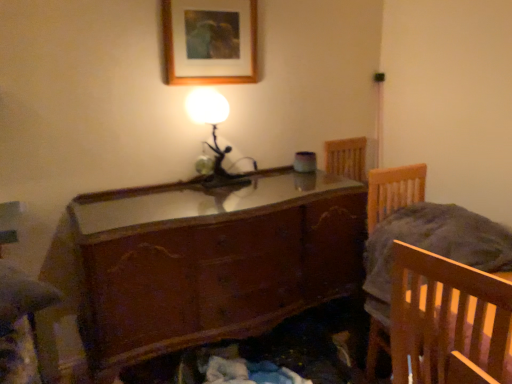
This screenshot has width=512, height=384. I want to click on wooden glossy chest of drawers at center, so click(x=210, y=261).

The image size is (512, 384). What do you see at coordinates (213, 133) in the screenshot? I see `matte glass table lamp at upper center` at bounding box center [213, 133].

This screenshot has width=512, height=384. In order to click on wooden picture frame at upper center in this screenshot , I will do `click(210, 44)`.

Describe the element at coordinates (210, 44) in the screenshot. I see `wooden picture frame at upper center` at that location.

This screenshot has width=512, height=384. Identify the location of wooden glossy chest of drawers at center. (210, 261).

Which is more to the right, wooden glossy chest of drawers at center or matte glass table lamp at upper center?

Positioned to the right is wooden glossy chest of drawers at center.

Which is behind, point (96, 377) or point (208, 102)?

The point (208, 102) is farther from the camera.

From the image's perspective, between wooden glossy chest of drawers at center and matte glass table lamp at upper center, who is located below?

From the image's view, wooden glossy chest of drawers at center is below.

Considering the sizes of objects matte glass table lamp at upper center and wooden glossy chest of drawers at center in the image provided, who is thinner, matte glass table lamp at upper center or wooden glossy chest of drawers at center?

Thinner between the two is matte glass table lamp at upper center.

From a real-world perspective, is matte glass table lamp at upper center under wooden glossy chest of drawers at center?

No, from a real-world perspective, matte glass table lamp at upper center is not beneath wooden glossy chest of drawers at center.

In terms of size, does matte glass table lamp at upper center appear bigger or smaller than wooden glossy chest of drawers at center?

Considering their sizes, matte glass table lamp at upper center takes up less space than wooden glossy chest of drawers at center.

Considering the relative sizes of matte glass table lamp at upper center and wooden glossy chest of drawers at center in the image provided, is matte glass table lamp at upper center taller than wooden glossy chest of drawers at center?

Incorrect, the height of matte glass table lamp at upper center is not larger of that of wooden glossy chest of drawers at center.

From the image's perspective, is wooden glossy chest of drawers at center located above or below wooden picture frame at upper center?

Clearly, from the image's perspective, wooden glossy chest of drawers at center is below wooden picture frame at upper center.

Can you tell me how much wooden glossy chest of drawers at center and wooden picture frame at upper center differ in facing direction?

The angular difference between wooden glossy chest of drawers at center and wooden picture frame at upper center is 1.72 degrees.

Considering the relative sizes of wooden glossy chest of drawers at center and wooden picture frame at upper center in the image provided, is wooden glossy chest of drawers at center wider than wooden picture frame at upper center?

Yes.

Between wooden glossy chest of drawers at center and wooden picture frame at upper center, which one is positioned behind?

wooden picture frame at upper center is further away from the camera.

Is wooden bed frame at right facing away from matte glass table lamp at upper center?

No.

Locate an element on the screen. This screenshot has width=512, height=384. furniture that appears below the matte glass table lamp at upper center (from the image's perspective) is located at coordinates (394, 190).

From a real-world perspective, is wooden bed frame at right above or below matte glass table lamp at upper center?

From a real-world perspective, wooden bed frame at right is physically below matte glass table lamp at upper center.

From the image's perspective, is wooden bed frame at right located beneath matte glass table lamp at upper center?

Indeed, from the image's perspective, wooden bed frame at right is shown beneath matte glass table lamp at upper center.

How far apart are matte glass table lamp at upper center and wooden bed frame at right?

matte glass table lamp at upper center is 81.11 centimeters from wooden bed frame at right.

Is matte glass table lamp at upper center located outside wooden bed frame at right?

matte glass table lamp at upper center is positioned outside wooden bed frame at right.

From a real-world perspective, is matte glass table lamp at upper center under wooden bed frame at right?

No, from a real-world perspective, matte glass table lamp at upper center is not below wooden bed frame at right.

From the image's perspective, does matte glass table lamp at upper center appear higher than wooden bed frame at right?

Indeed, from the image's perspective, matte glass table lamp at upper center is shown above wooden bed frame at right.

Can you confirm if matte glass table lamp at upper center is thinner than wooden picture frame at upper center?

No, matte glass table lamp at upper center is not thinner than wooden picture frame at upper center.

In the image, is matte glass table lamp at upper center positioned in front of or behind wooden picture frame at upper center?

matte glass table lamp at upper center is behind wooden picture frame at upper center.

Considering the positions of point (215, 133) and point (187, 67), is point (215, 133) closer or farther from the camera than point (187, 67)?

Point (215, 133) is farther from the camera than point (187, 67).

Is matte glass table lamp at upper center located outside wooden picture frame at upper center?

Absolutely, matte glass table lamp at upper center is external to wooden picture frame at upper center.

Where is `chest of drawers above the wooden bed frame at right (from the image's perspective)`? This screenshot has width=512, height=384. chest of drawers above the wooden bed frame at right (from the image's perspective) is located at coordinates (210, 261).

Is wooden bed frame at right thinner than wooden glossy chest of drawers at center?

Correct, the width of wooden bed frame at right is less than that of wooden glossy chest of drawers at center.

From the image's perspective, between wooden bed frame at right and wooden glossy chest of drawers at center, who is located below?

From the image's view, wooden bed frame at right is below.

Is point (395, 200) closer or farther from the camera than point (166, 217)?

Point (395, 200).

Where is `chest of drawers located on the right of matte glass table lamp at upper center`? chest of drawers located on the right of matte glass table lamp at upper center is located at coordinates (210, 261).

In order to click on table lamp above the wooden glossy chest of drawers at center (from a real-world perspective) in this screenshot , I will do `click(213, 133)`.

Estimate the real-world distances between objects in this image. Which object is closer to wooden picture frame at upper center, matte glass table lamp at upper center or wooden glossy chest of drawers at center?

Based on the image, matte glass table lamp at upper center appears to be nearer to wooden picture frame at upper center.

Based on their spatial positions, is wooden picture frame at upper center or wooden glossy chest of drawers at center closer to matte glass table lamp at upper center?

wooden picture frame at upper center lies closer to matte glass table lamp at upper center than the other object.

When comparing their distances from matte glass table lamp at upper center, does wooden glossy chest of drawers at center or wooden bed frame at right seem further?

wooden bed frame at right lies further to matte glass table lamp at upper center than the other object.

Which object lies further to the anchor point wooden picture frame at upper center, wooden bed frame at right or matte glass table lamp at upper center?

Based on the image, wooden bed frame at right appears to be further to wooden picture frame at upper center.

From the image, which object appears to be farther from wooden picture frame at upper center, wooden glossy chest of drawers at center or wooden bed frame at right?

The object further to wooden picture frame at upper center is wooden bed frame at right.

Which object lies further to the anchor point wooden bed frame at right, wooden glossy chest of drawers at center or matte glass table lamp at upper center?

matte glass table lamp at upper center is further to wooden bed frame at right.

When comparing their distances from wooden bed frame at right, does wooden glossy chest of drawers at center or wooden picture frame at upper center seem closer?

wooden glossy chest of drawers at center.

Looking at the image, which one is located further to wooden bed frame at right, wooden picture frame at upper center or matte glass table lamp at upper center?

wooden picture frame at upper center lies further to wooden bed frame at right than the other object.

Where is `the chest of drawers situated between matte glass table lamp at upper center and wooden bed frame at right from left to right`? The width and height of the screenshot is (512, 384). the chest of drawers situated between matte glass table lamp at upper center and wooden bed frame at right from left to right is located at coordinates (210, 261).

Find the location of a particular element. table lamp between wooden picture frame at upper center and wooden glossy chest of drawers at center in the vertical direction is located at coordinates (213, 133).

You are a GUI agent. You are given a task and a screenshot of the screen. Output one action in this format:
    pyautogui.click(x=<x>, y=<y>)
    Task: Click on the table lamp between wooden picture frame at upper center and wooden bed frame at right in the vertical direction
    
    Given the screenshot: What is the action you would take?
    pyautogui.click(x=213, y=133)

Locate an element on the screen. the chest of drawers between wooden picture frame at upper center and wooden bed frame at right vertically is located at coordinates (210, 261).